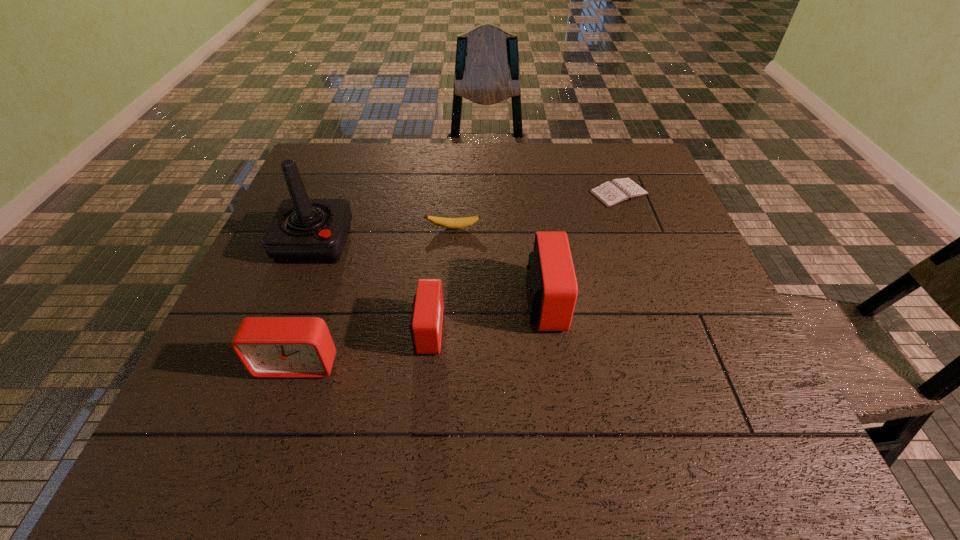
Locate an element on the screen. The image size is (960, 540). free space between the joystick and the shortest alarm clock is located at coordinates (372, 287).

The width and height of the screenshot is (960, 540). I want to click on free spot between the rightmost object and the second alarm clock from right to left, so click(x=523, y=262).

You are a GUI agent. You are given a task and a screenshot of the screen. Output one action in this format:
    pyautogui.click(x=<x>, y=<y>)
    Task: Click on the blank region between the leftmost alarm clock and the banana
    
    Given the screenshot: What is the action you would take?
    pyautogui.click(x=375, y=296)

Image resolution: width=960 pixels, height=540 pixels. What are the coordinates of `unoccupied area between the second shortest object and the tallest object` in the screenshot? It's located at (384, 235).

Locate an element on the screen. The height and width of the screenshot is (540, 960). free space between the second object from right to left and the banana is located at coordinates (499, 265).

I want to click on free space between the farthest object and the fourth shortest object, so click(x=458, y=279).

Where is `unoccupied area between the diary and the leftmost alarm clock`? unoccupied area between the diary and the leftmost alarm clock is located at coordinates (458, 279).

At what (x,y) coordinates should I click in order to perform the action: click on object that stands as the fifth closest to the tallest object. Please return your answer as a coordinate pair (x, y). This screenshot has width=960, height=540. Looking at the image, I should click on (617, 191).

Where is `object that is the fourth closest to the second object from right to left`? The width and height of the screenshot is (960, 540). object that is the fourth closest to the second object from right to left is located at coordinates (269, 347).

Point out which alarm clock is positioned as the nearest to the banana. Please provide its 2D coordinates. Your answer should be formatted as a tuple, i.e. [(x, y)], where the tuple contains the x and y coordinates of a point satisfying the conditions above.

[(551, 284)]